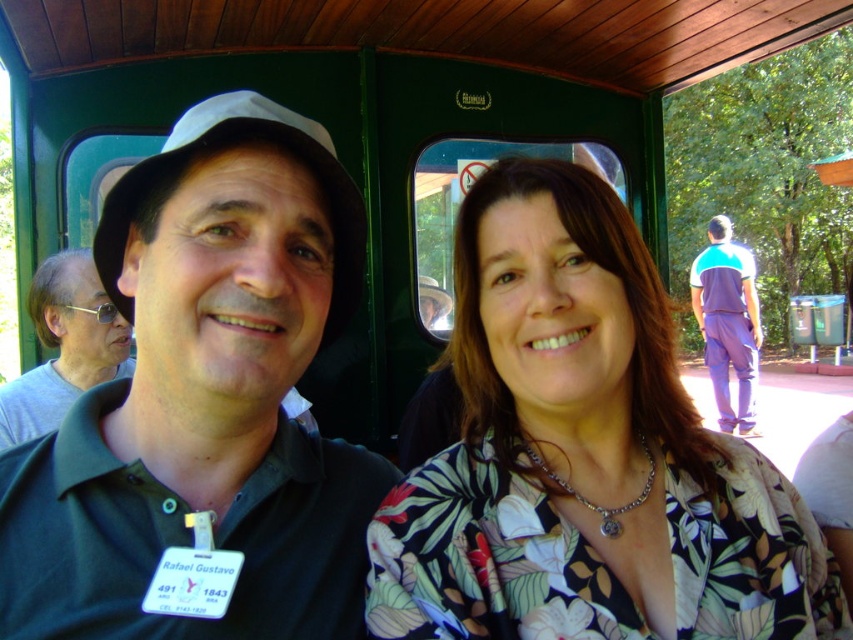
Question: Which point is closer to the camera?

Choices:
 (A) black matte hat at upper left
 (B) floral print blouse at center
 (C) matte black shirt at left

Answer: (A)

Question: Estimate the real-world distances between objects in this image. Which object is closer to the black matte hat at upper left?

Choices:
 (A) purple cotton pants at right
 (B) floral print blouse at center
 (C) matte black shirt at left

Answer: (B)

Question: Is matte black shirt at left thinner than purple cotton pants at right?

Choices:
 (A) yes
 (B) no

Answer: (A)

Question: Is floral print blouse at center thinner than matte black shirt at left?

Choices:
 (A) yes
 (B) no

Answer: (B)

Question: From the image, what is the correct spatial relationship of black matte hat at upper left in relation to matte black shirt at left?

Choices:
 (A) right
 (B) left

Answer: (A)

Question: Which object is farther from the camera taking this photo?

Choices:
 (A) floral print blouse at center
 (B) matte black shirt at left

Answer: (B)